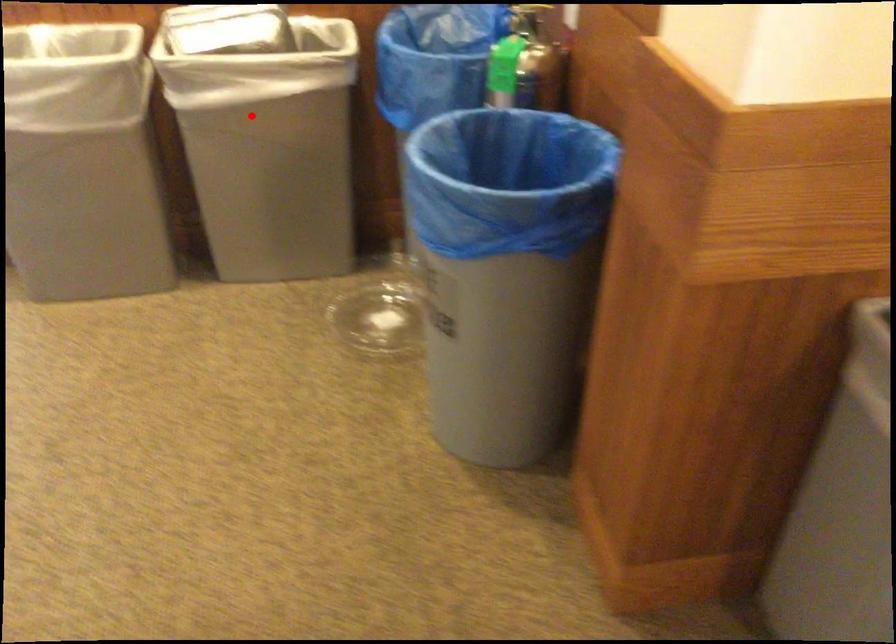
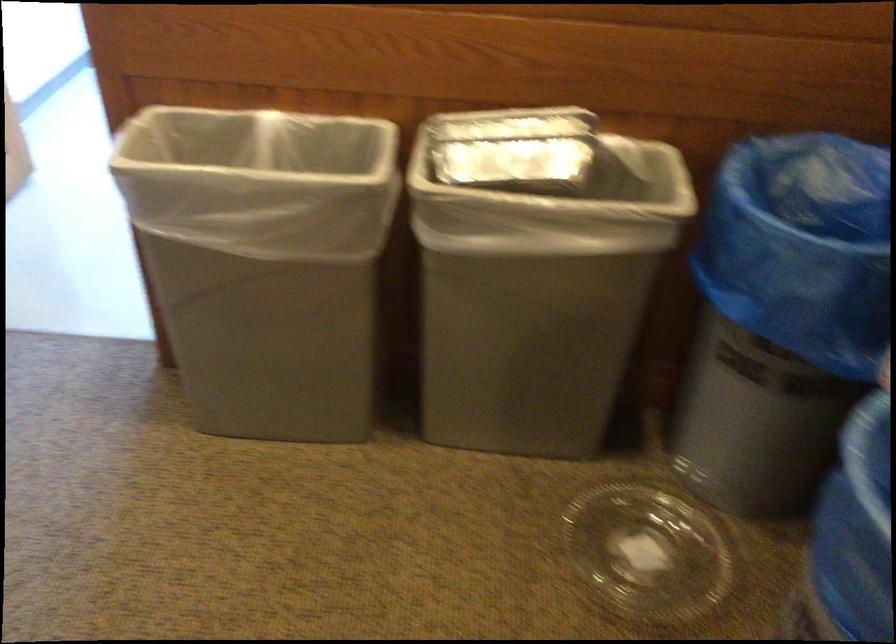
Question: I am providing you with two images of the same scene from different viewpoints. In image1, a red point is highlighted. Considering the same 3D point in image2, which of the following is correct?

Choices:
 (A) It is closer
 (B) It is farther

Answer: (A)